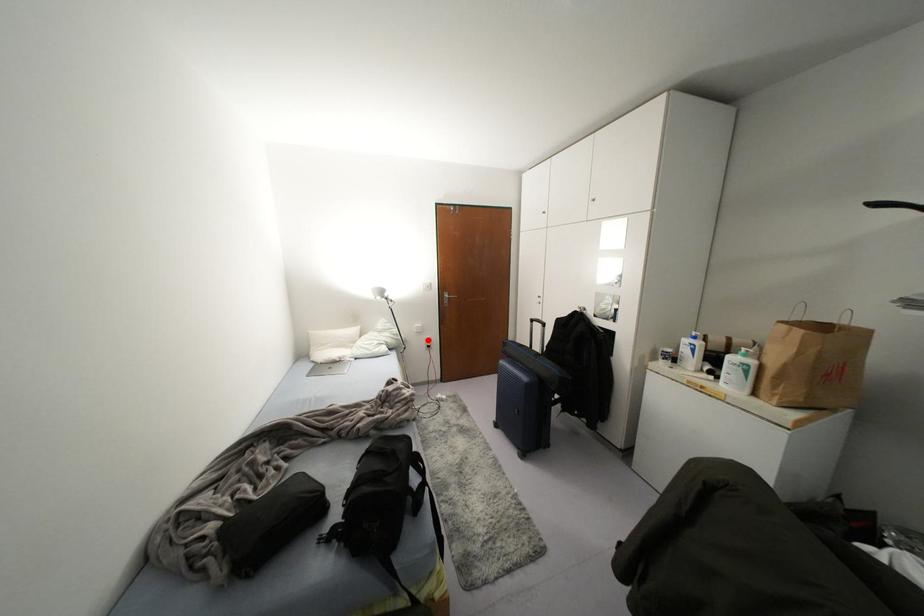
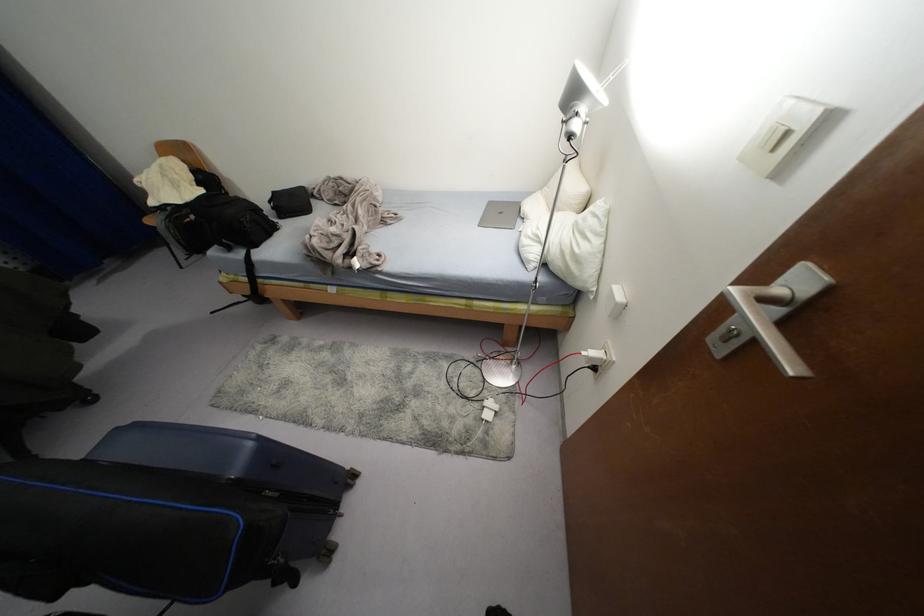
Find the pixel in the second image that matches the highlighted location in the first image.

(592, 353)